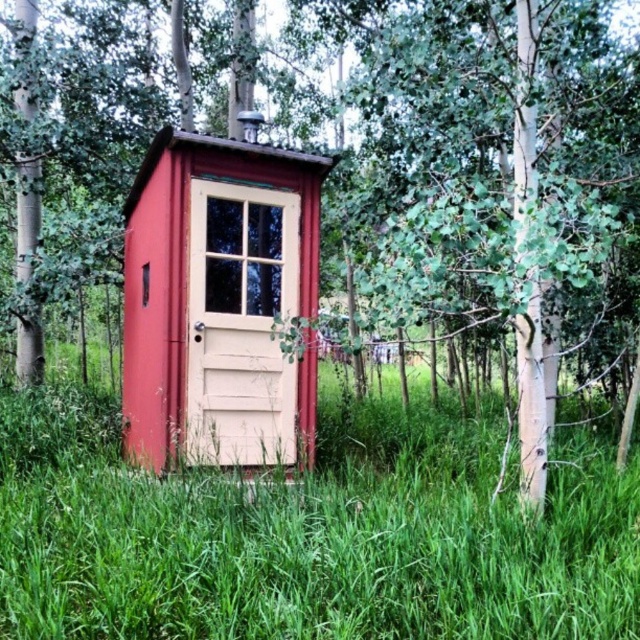
You are standing in the forest and see the green grass at center and the matte wood cabin at center. Which one is closer to you?

The green grass at center is closer to you because it is in front of the matte wood cabin at center.

You are standing at the edge of the forest and want to walk to the matte wood cabin at center. The green grass at center is the only path available. If your stride length is 14 inches per step, how many steps will it take you to reach the cabin?

The distance between green grass at center and matte wood cabin at center is 35.28 inches. Dividing this distance by your stride length of 14 inches per step gives 35.28 divided by 14 equals approximately 2.52 steps. Since you can only take whole steps, you will need 3 full steps to reach the cabin.

You are standing in front of the rustic red shed and want to determine the relative positions of two points marked on its structure. Which of the two points, point (x=212, y=472) or point (x=268, y=349), is closer to your current position?

Point (x=212, y=472) is closer to the camera than point (x=268, y=349), so it is closer to your current position.